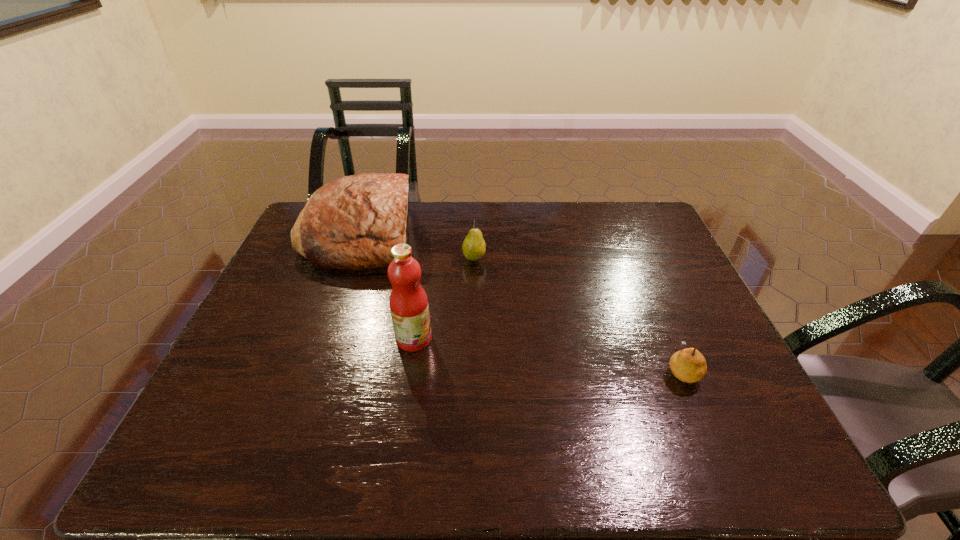
This screenshot has height=540, width=960. Identify the location of vacant space at the near left corner of the desktop. (184, 450).

This screenshot has height=540, width=960. Find the location of `vacant area at the near right corner`. vacant area at the near right corner is located at coordinates (732, 438).

The image size is (960, 540). In order to click on free space between the nearer pear and the bread in this screenshot , I will do `click(520, 302)`.

I want to click on free area in between the shorter pear and the fruit juice, so click(x=547, y=354).

Where is `free space between the bread and the nearer pear`? free space between the bread and the nearer pear is located at coordinates (520, 302).

Find the location of `empty space that is in between the rightmost object and the third shortest object`. empty space that is in between the rightmost object and the third shortest object is located at coordinates (520, 302).

Locate an element on the screen. unoccupied area between the third object from left to right and the second tallest object is located at coordinates (417, 246).

Where is `vacant point located between the second tallest object and the third object from left to right`? The width and height of the screenshot is (960, 540). vacant point located between the second tallest object and the third object from left to right is located at coordinates (417, 246).

This screenshot has height=540, width=960. In order to click on free spot between the taller pear and the fruit juice in this screenshot , I will do `click(444, 299)`.

Locate an element on the screen. The width and height of the screenshot is (960, 540). free space between the leftmost object and the shortest object is located at coordinates (520, 302).